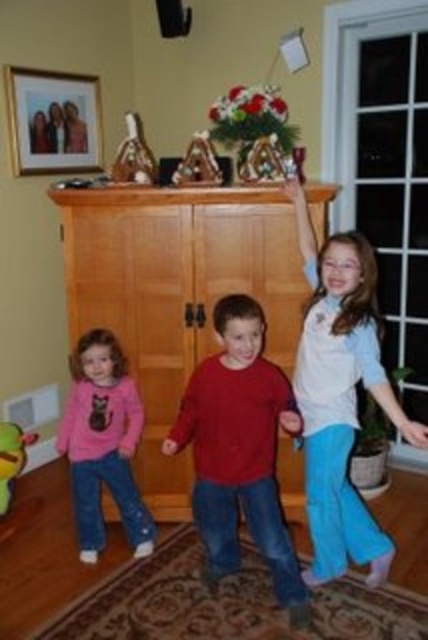
Based on the photo, you are a parent trying to give your children candies. You see the shiny chocolate candy at center and the metallic triangular ornament at center. Which item is located higher up?

The shiny chocolate candy at center is positioned over the metallic triangular ornament at center, so it is higher up.

You are a parent who wants to give a shiny chocolate candy at center to your child. The white cotton shirt at upper right is in the way. Can you reach the candy without moving the shirt?

The white cotton shirt at upper right is located below the shiny chocolate candy at center, so you can reach the candy without moving the shirt since it is above the shirt.

What is located at the coordinates point (133, 156)?

The coordinates point (133, 156) indicate the location of shiny chocolate candy at center.